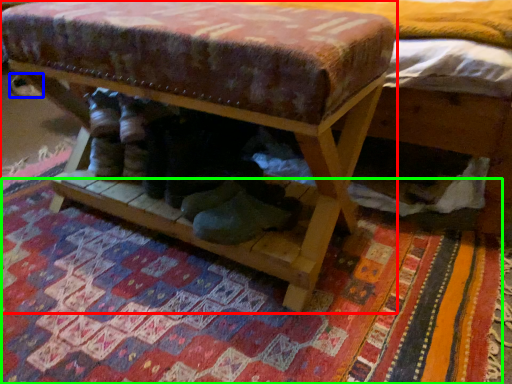
Question: Considering the real-world distances, which object is closest to furniture (highlighted by a red box)? shoe (highlighted by a blue box) or mat (highlighted by a green box).

Choices:
 (A) shoe
 (B) mat

Answer: (B)